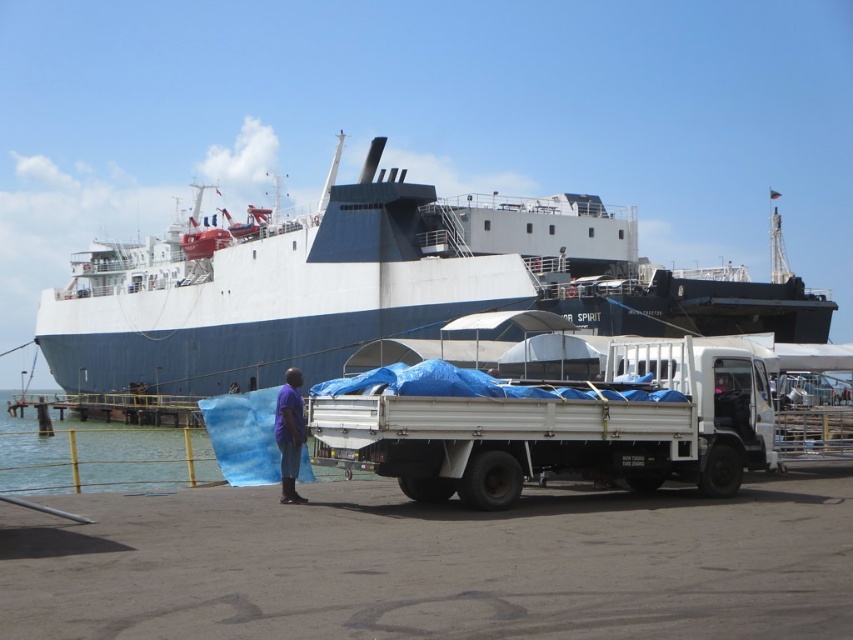
You are a crane operator at the port. You need to lower a container from the crane onto the blue water at lower left. However, there is a white matte ship at upper center in the way. Can you safely lower the container without hitting the ship?

The white matte ship at upper center is much taller than the blue water at lower left, so lowering the container onto the blue water at lower left may risk hitting the ship. You should adjust the crane to ensure the container is placed safely away from the ship.

You are a photographer planning to take a wide shot of the port scene. Given the white matte trailer truck at center and the blue water at lower left, which object will appear smaller in the final photo?

The white matte trailer truck at center will appear smaller in the photo because it occupies less space than the blue water at lower left according to the description.